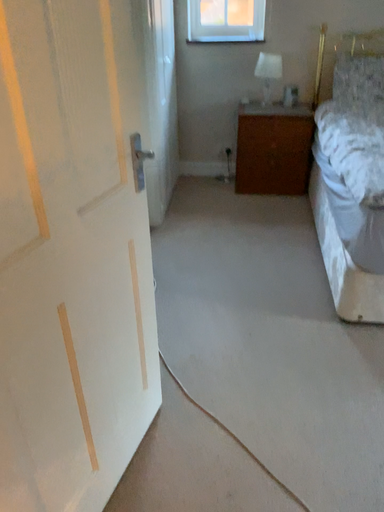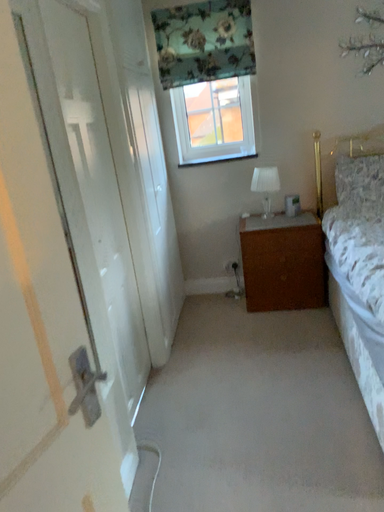
Question: Which way did the camera rotate in the video?

Choices:
 (A) rotated upward
 (B) rotated downward

Answer: (A)